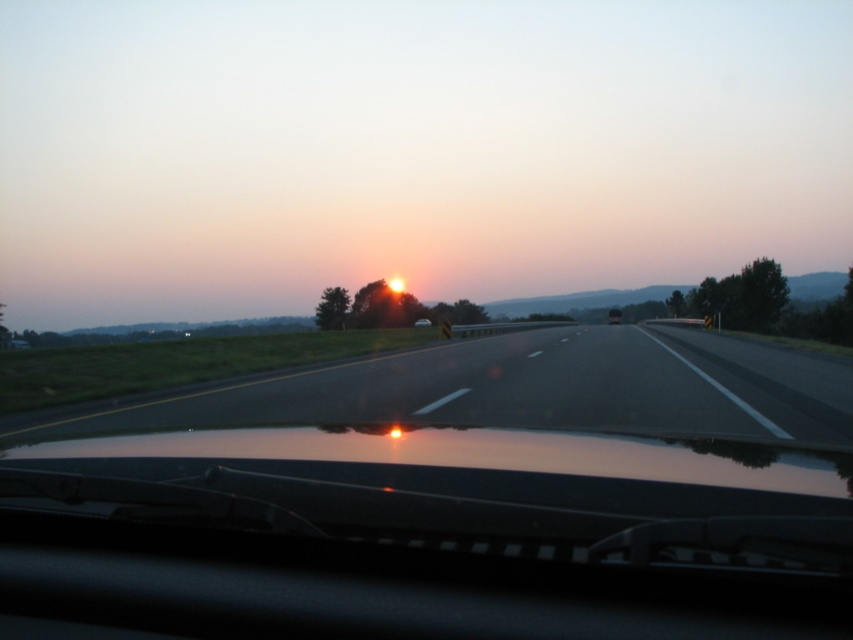
Question: Is black asphalt highway at center smaller than matte black car at center?

Choices:
 (A) no
 (B) yes

Answer: (A)

Question: Which of the following is the closest to the observer?

Choices:
 (A) (618, 323)
 (B) (811, 369)

Answer: (B)

Question: Does black asphalt highway at center appear over matte black car at center?

Choices:
 (A) no
 (B) yes

Answer: (A)

Question: Which point is farther from the camera taking this photo?

Choices:
 (A) (660, 390)
 (B) (612, 317)

Answer: (B)

Question: Is black asphalt highway at center bigger than matte black car at center?

Choices:
 (A) yes
 (B) no

Answer: (A)